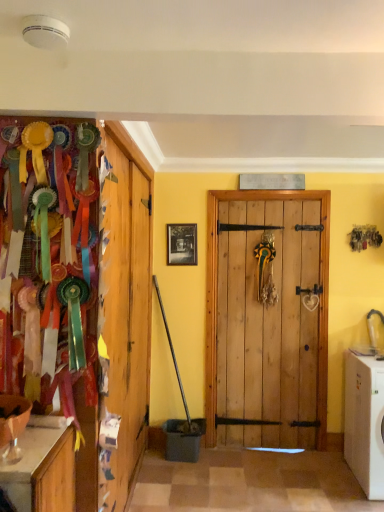
Question: Considering the relative positions of black matte picture frame at center and white plastic washing machine at lower right in the image provided, is black matte picture frame at center to the left or to the right of white plastic washing machine at lower right?

Choices:
 (A) left
 (B) right

Answer: (A)

Question: Relative to white plastic washing machine at lower right, is black matte picture frame at center in front or behind?

Choices:
 (A) front
 (B) behind

Answer: (B)

Question: Looking at the image, does black matte picture frame at center seem bigger or smaller compared to white plastic washing machine at lower right?

Choices:
 (A) small
 (B) big

Answer: (A)

Question: Which is correct: white plastic washing machine at lower right is inside black matte picture frame at center, or outside of it?

Choices:
 (A) inside
 (B) outside

Answer: (B)

Question: From the image's perspective, is white plastic washing machine at lower right positioned above or below black matte picture frame at center?

Choices:
 (A) below
 (B) above

Answer: (A)

Question: Based on their positions, is white plastic washing machine at lower right located to the left or right of black matte picture frame at center?

Choices:
 (A) right
 (B) left

Answer: (A)

Question: In the image, is white plastic washing machine at lower right positioned in front of or behind black matte picture frame at center?

Choices:
 (A) front
 (B) behind

Answer: (A)